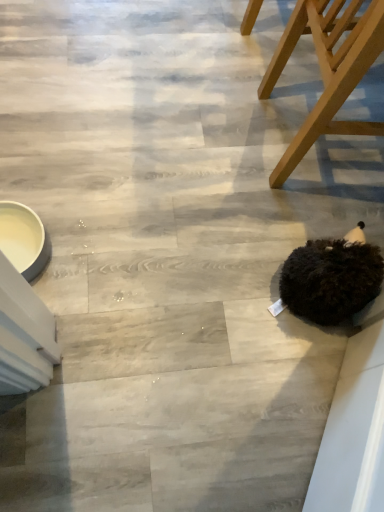
Locate an element on the screen. vacant space in wooden chair at upper right (from a real-world perspective) is located at coordinates click(339, 135).